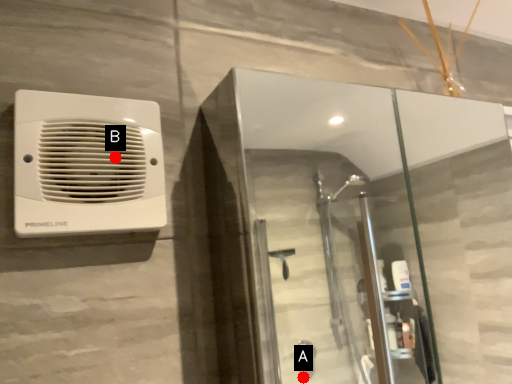
Question: Two points are circled on the image, labeled by A and B beside each circle. Which point is farther from the camera taking this photo?

Choices:
 (A) A is further
 (B) B is further

Answer: (A)